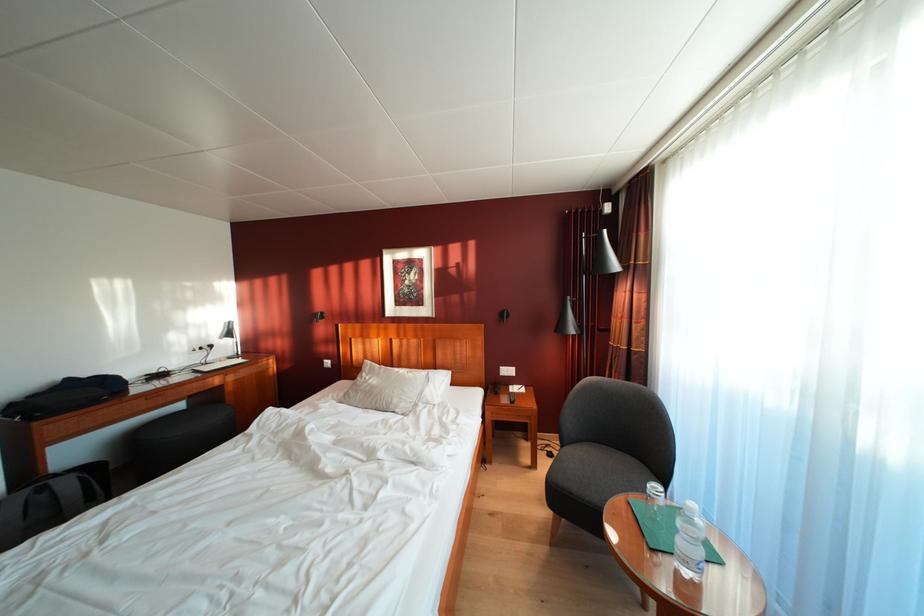
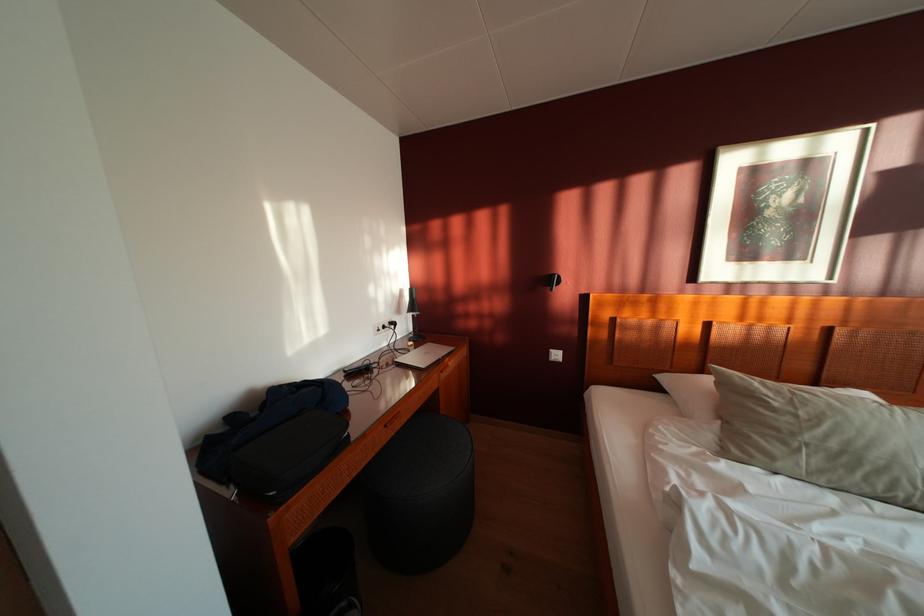
Which direction would the cameraman need to move to produce the second image?

The cameraman walked toward left, forward.